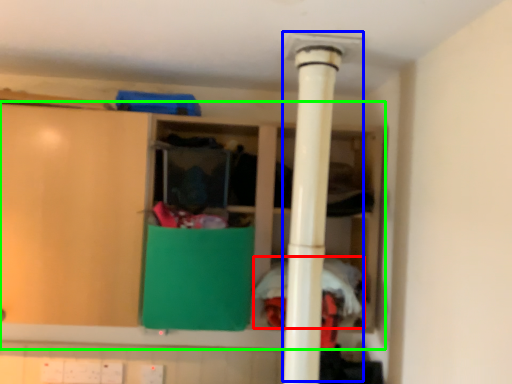
Question: Which object is the closest to the clothing (highlighted by a red box)? Choose among these: water heater (highlighted by a blue box) or cupboard (highlighted by a green box).

Choices:
 (A) water heater
 (B) cupboard

Answer: (A)